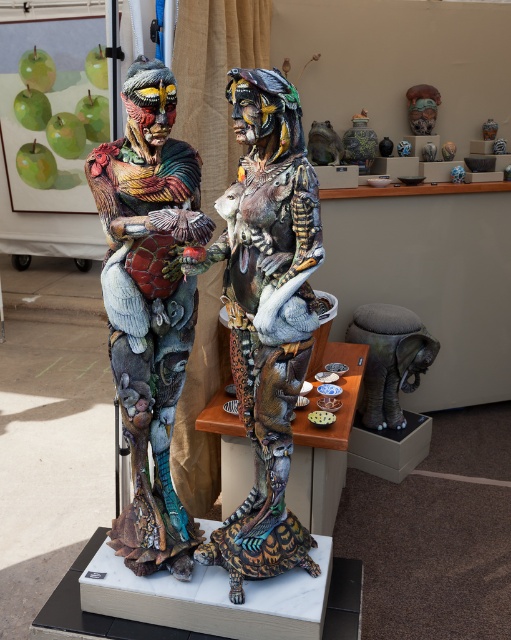
Question: Based on their relative distances, which object is farther from the brown leather stool at lower right?

Choices:
 (A) multicolored painted figure at center
 (B) multicolored painted sculpture at center

Answer: (B)

Question: Can you confirm if multicolored painted figure at center is positioned to the right of brown leather stool at lower right?

Choices:
 (A) no
 (B) yes

Answer: (A)

Question: Which point is farther to the camera?

Choices:
 (A) brown leather stool at lower right
 (B) multicolored painted sculpture at center

Answer: (A)

Question: Is multicolored painted figure at center above brown leather stool at lower right?

Choices:
 (A) no
 (B) yes

Answer: (B)

Question: Can you confirm if multicolored painted figure at center is thinner than multicolored painted sculpture at center?

Choices:
 (A) yes
 (B) no

Answer: (B)

Question: Based on their relative distances, which object is nearer to the multicolored painted sculpture at center?

Choices:
 (A) brown leather stool at lower right
 (B) multicolored painted figure at center

Answer: (B)